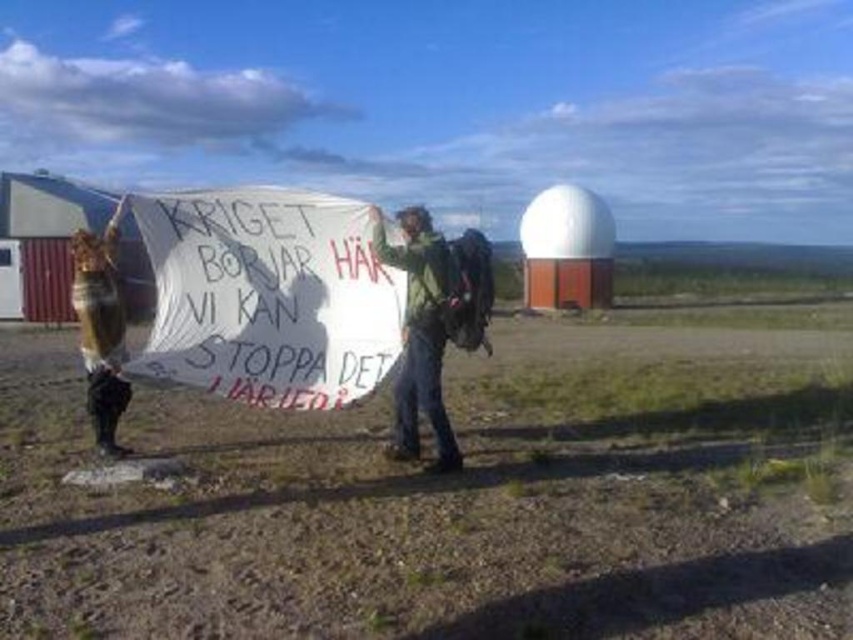
Question: Is white paper sign at center positioned at the back of wooden sign at left?

Choices:
 (A) no
 (B) yes

Answer: (A)

Question: Which of these objects is positioned farthest from the green fabric at center?

Choices:
 (A) brown dirt field at center
 (B) wooden sign at left
 (C) white paper sign at center

Answer: (B)

Question: Which object appears farthest from the camera in this image?

Choices:
 (A) wooden sign at left
 (B) white paper sign at center

Answer: (A)

Question: Which of the following is the farthest from the observer?

Choices:
 (A) wooden sign at left
 (B) brown dirt field at center
 (C) white paper sign at center

Answer: (A)

Question: Does white paper sign at center appear on the right side of wooden sign at left?

Choices:
 (A) yes
 (B) no

Answer: (A)

Question: Does white paper sign at center have a larger size compared to green fabric at center?

Choices:
 (A) no
 (B) yes

Answer: (B)